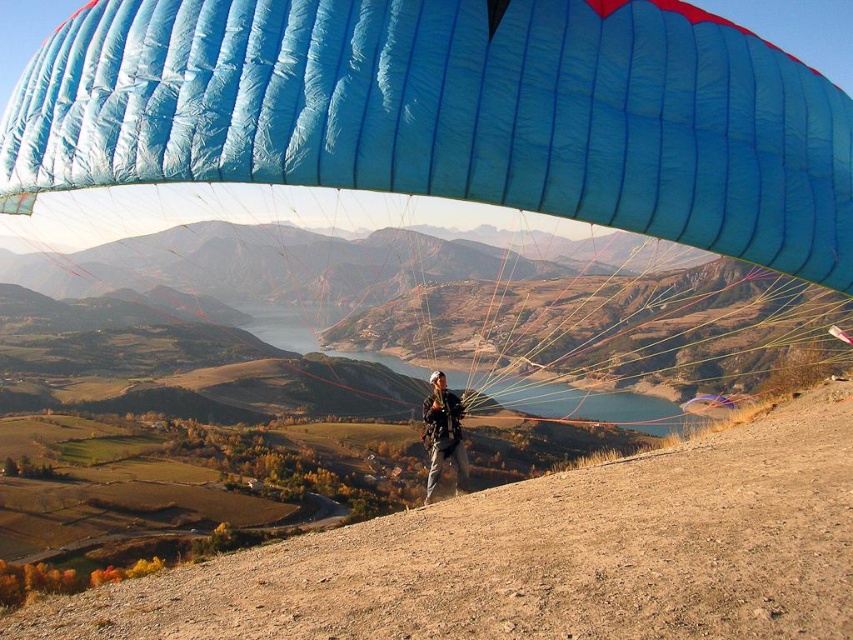
This screenshot has height=640, width=853. Describe the element at coordinates (453, 113) in the screenshot. I see `blue fabric parachute at center` at that location.

Looking at this image, can you confirm if blue fabric parachute at center is bigger than matte black helmet at center?

Yes, blue fabric parachute at center is bigger than matte black helmet at center.

Between point (248, 180) and point (440, 460), which one is positioned behind?

The point (440, 460) is more distant.

Locate an element on the screen. This screenshot has height=640, width=853. blue fabric parachute at center is located at coordinates (453, 113).